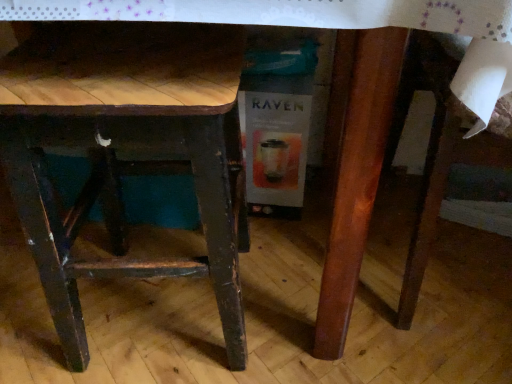
The width and height of the screenshot is (512, 384). I want to click on dark wood step stool at left, so click(x=124, y=147).

What is the approximate height of dark wood step stool at left?

dark wood step stool at left is 50.23 centimeters tall.

What do you see at coordinates (124, 147) in the screenshot? The image size is (512, 384). I see `dark wood step stool at left` at bounding box center [124, 147].

Where is `dark wood step stool at left`? The image size is (512, 384). dark wood step stool at left is located at coordinates (124, 147).